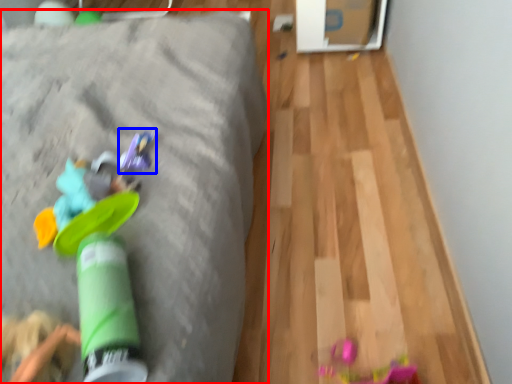
Question: Which point is closer to the camera, furniture (highlighted by a red box) or toy (highlighted by a blue box)?

Choices:
 (A) furniture
 (B) toy

Answer: (B)